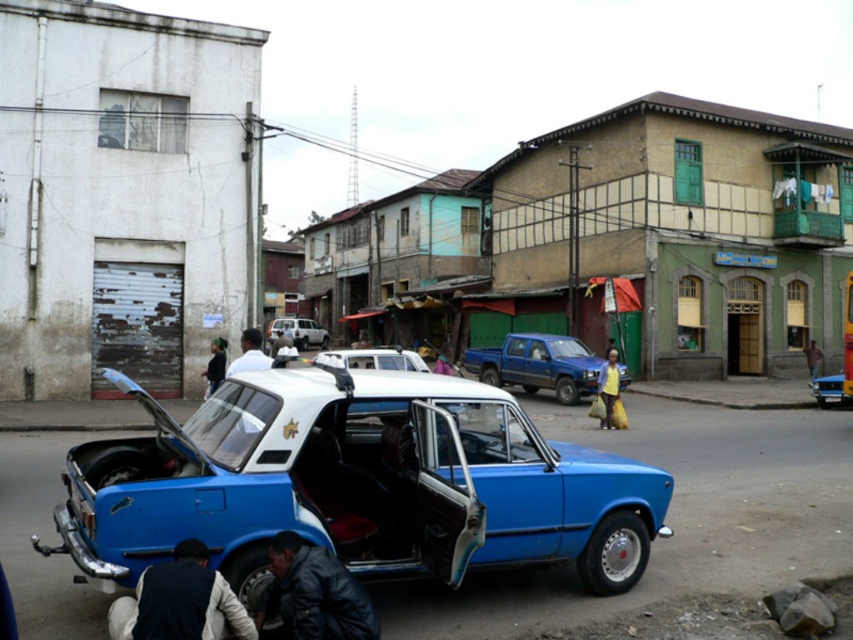
Question: Which object is positioned farthest from the dark blue leather jacket at lower left?

Choices:
 (A) blue matte car at center
 (B) yellow fabric bag at center

Answer: (B)

Question: Does blue matte car at center have a greater width compared to white matte car at center?

Choices:
 (A) yes
 (B) no

Answer: (B)

Question: Based on their relative distances, which object is farther from the blue matte truck at center?

Choices:
 (A) dark blue leather jacket at lower left
 (B) leather jacket at lower center

Answer: (A)

Question: Where is blue matte car at center located in relation to yellow fabric bag at center in the image?

Choices:
 (A) above
 (B) below

Answer: (A)

Question: Does leather jacket at lower center lie behind dark blue shirt at center?

Choices:
 (A) yes
 (B) no

Answer: (B)

Question: Which of the following is the farthest from the observer?

Choices:
 (A) matte silver suv at center
 (B) yellow fabric bag at center
 (C) dark blue leather jacket at lower left
 (D) leather jacket at lower center

Answer: (A)